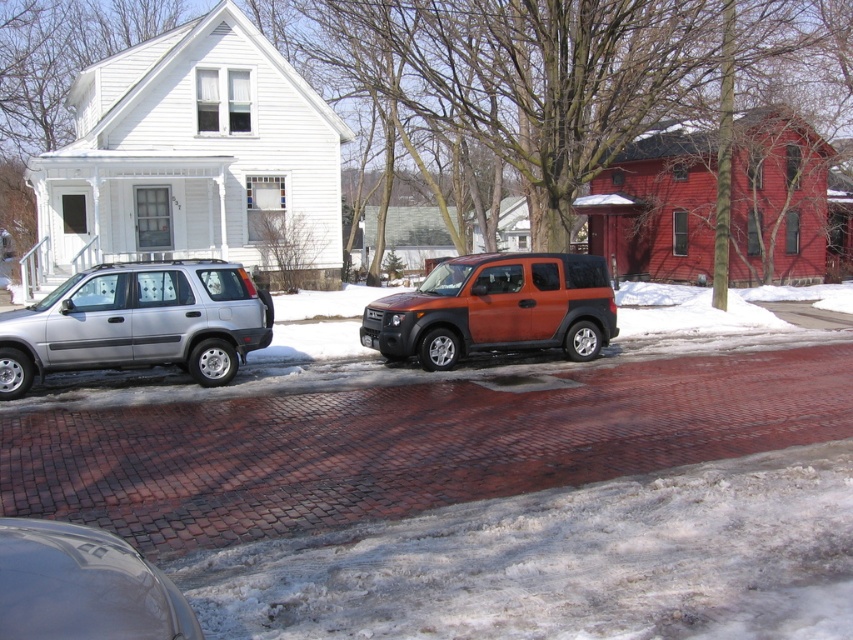
Question: Which point is farther to the camera?

Choices:
 (A) shiny black car at lower left
 (B) orange matte suv at center
 (C) silver metallic suv at left

Answer: (B)

Question: Which object is positioned closest to the silver metallic suv at left?

Choices:
 (A) shiny black car at lower left
 (B) orange matte suv at center

Answer: (B)

Question: From the image, what is the correct spatial relationship of silver metallic suv at left in relation to orange matte suv at center?

Choices:
 (A) above
 (B) below

Answer: (B)

Question: Where is silver metallic suv at left located in relation to shiny black car at lower left in the image?

Choices:
 (A) left
 (B) right

Answer: (A)

Question: Is silver metallic suv at left above shiny black car at lower left?

Choices:
 (A) no
 (B) yes

Answer: (B)

Question: Which of the following is the farthest from the observer?

Choices:
 (A) orange matte suv at center
 (B) shiny black car at lower left
 (C) silver metallic suv at left

Answer: (A)